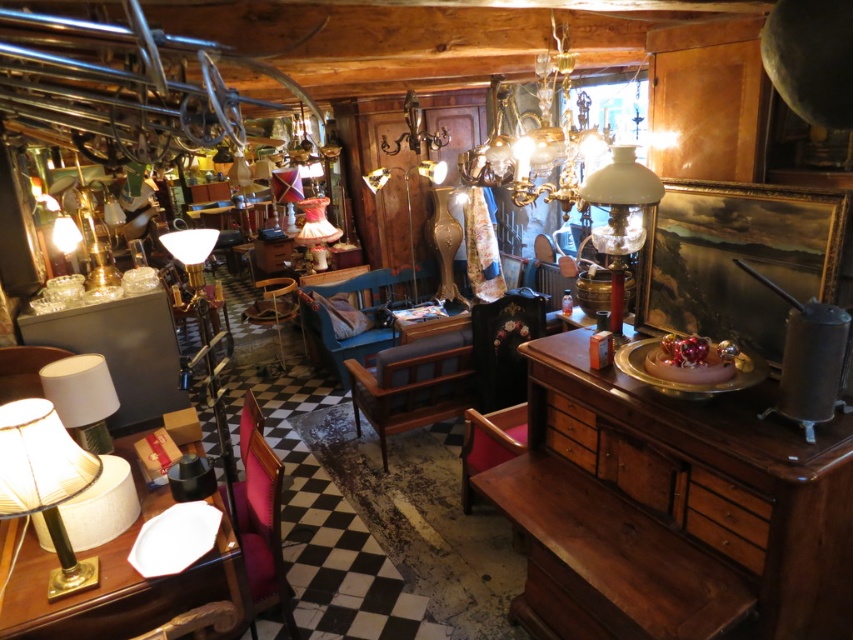
Question: Can you confirm if white fabric table at lower left is positioned to the left of dark blue fabric chair at center?

Choices:
 (A) yes
 (B) no

Answer: (A)

Question: Which object appears farthest from the camera in this image?

Choices:
 (A) pink velvet chair at center
 (B) white glass lamp at right
 (C) gold metallic lampshade at lower left
 (D) dark blue fabric chair at center

Answer: (D)

Question: Which point appears farthest from the camera in this image?

Choices:
 (A) (503, 104)
 (B) (763, 515)
 (C) (561, 632)

Answer: (A)

Question: Can you confirm if wooden dresser at right is thinner than dark blue fabric chair at center?

Choices:
 (A) no
 (B) yes

Answer: (B)

Question: Does wooden dresser at right lie behind velvet pink chair at lower left?

Choices:
 (A) yes
 (B) no

Answer: (B)

Question: Estimate the real-world distances between objects in this image. Which object is closer to the gold metallic chandelier at upper center?

Choices:
 (A) velvet pink chair at center
 (B) velvet pink chair at lower left

Answer: (A)